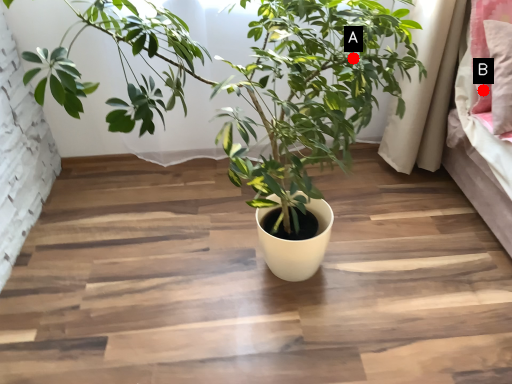
Question: Two points are circled on the image, labeled by A and B beside each circle. Which point is closer to the camera?

Choices:
 (A) A is closer
 (B) B is closer

Answer: (A)